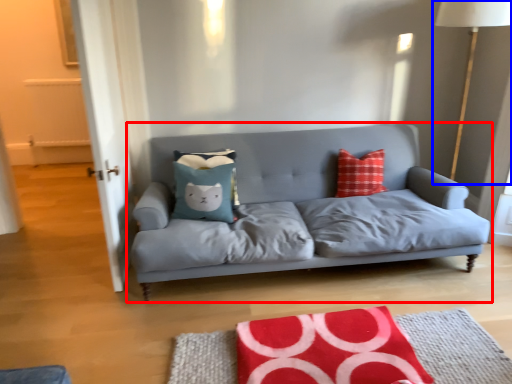
Question: Among these objects, which one is nearest to the camera, studio couch (highlighted by a red box) or table lamp (highlighted by a blue box)?

Choices:
 (A) studio couch
 (B) table lamp

Answer: (A)